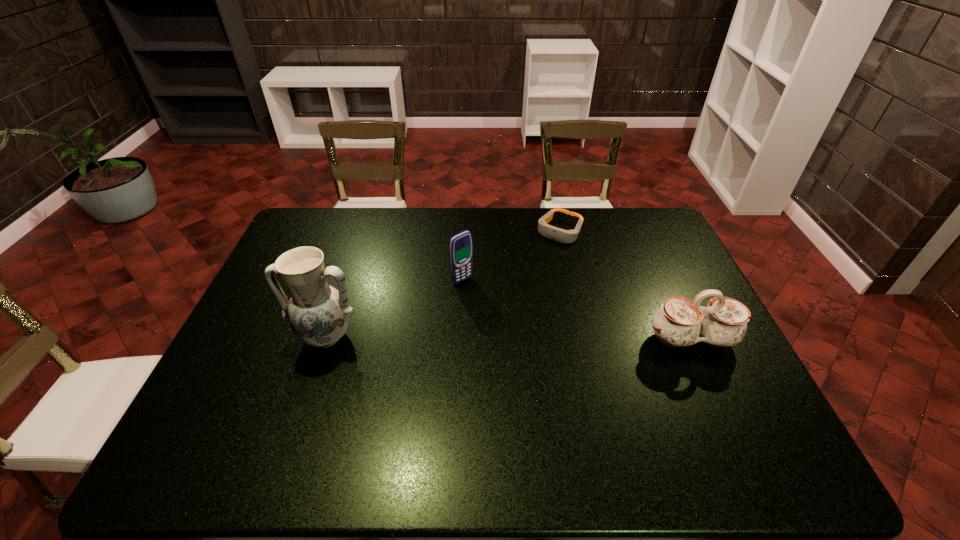
The width and height of the screenshot is (960, 540). Find the location of `empty space that is in between the second object from left to right and the shortest object`. empty space that is in between the second object from left to right and the shortest object is located at coordinates (511, 256).

Where is `free space between the pottery and the farthest object`? Image resolution: width=960 pixels, height=540 pixels. free space between the pottery and the farthest object is located at coordinates click(x=443, y=284).

The width and height of the screenshot is (960, 540). In order to click on vacant region between the cellular telephone and the farthest object in this screenshot , I will do `click(511, 256)`.

This screenshot has width=960, height=540. Identify the location of vacant area between the rightmost object and the third nearest object. (577, 310).

At what (x,y) coordinates should I click in order to perform the action: click on object identified as the closest to the rightmost object. Please return your answer as a coordinate pair (x, y). Looking at the image, I should click on (565, 236).

Find the location of a particular element. This screenshot has height=540, width=960. object identified as the second closest to the rightmost object is located at coordinates (460, 246).

Identify the location of free space that satisfies the following two spatial constraints: 1. on the back side of the farthest object; 2. on the left side of the cellular telephone. The height and width of the screenshot is (540, 960). (465, 232).

The width and height of the screenshot is (960, 540). Identify the location of free space that satisfies the following two spatial constraints: 1. on the back side of the cellular telephone; 2. on the right side of the goggles. (465, 232).